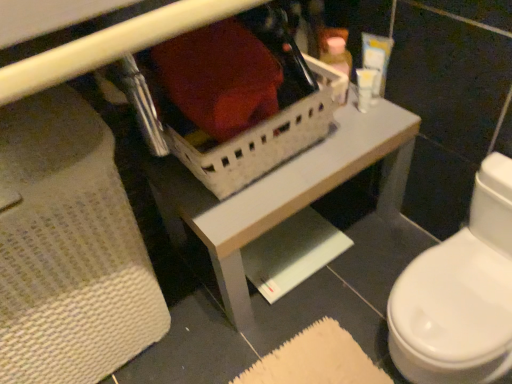
Question: Considering the positions of white plastic basket at center and white plastic container at upper right, placed as the 1th toiletry when sorted from right to left, in the image, is white plastic basket at center bigger or smaller than white plastic container at upper right, placed as the 1th toiletry when sorted from right to left,?

Choices:
 (A) small
 (B) big

Answer: (B)

Question: From a real-world perspective, is white plastic basket at center physically located above or below white plastic container at upper right, marked as the third toiletry in a left-to-right arrangement?

Choices:
 (A) below
 (B) above

Answer: (B)

Question: Which object is the closest to the white plastic container at upper right, placed as the 2th toiletry when sorted from left to right?

Choices:
 (A) white plastic container at upper right, marked as the third toiletry in a left-to-right arrangement
 (B) white plastic container at upper center, positioned as the 3th toiletry in right-to-left order
 (C) white plastic basket at center
 (D) white plastic basket at center

Answer: (A)

Question: Which object is the closest to the white plastic container at upper right, placed as the 2th toiletry when sorted from left to right?

Choices:
 (A) white plastic container at upper right, marked as the third toiletry in a left-to-right arrangement
 (B) white plastic basket at center
 (C) white plastic container at upper center, positioned as the 3th toiletry in right-to-left order
 (D) white plastic basket at center

Answer: (A)